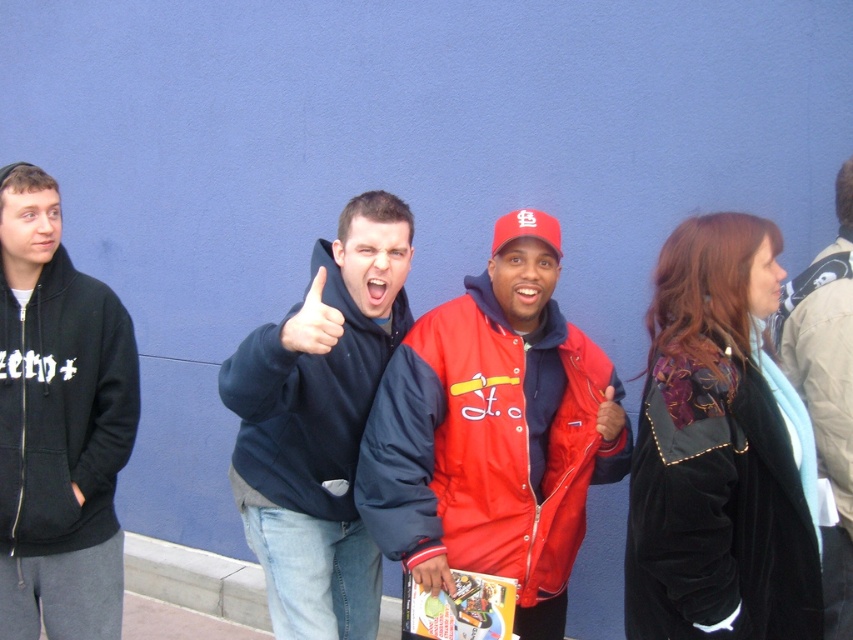
You are a photographer trying to capture a photo of the dark blue hoodie at center and the smooth plastic hand at center. If you want to ensure both objects are fully visible in the frame, which object should you focus on to avoid cropping?

You should focus on the dark blue hoodie at center because it might be wider than the smooth plastic hand at center, so centering the wider object ensures both fit within the frame.